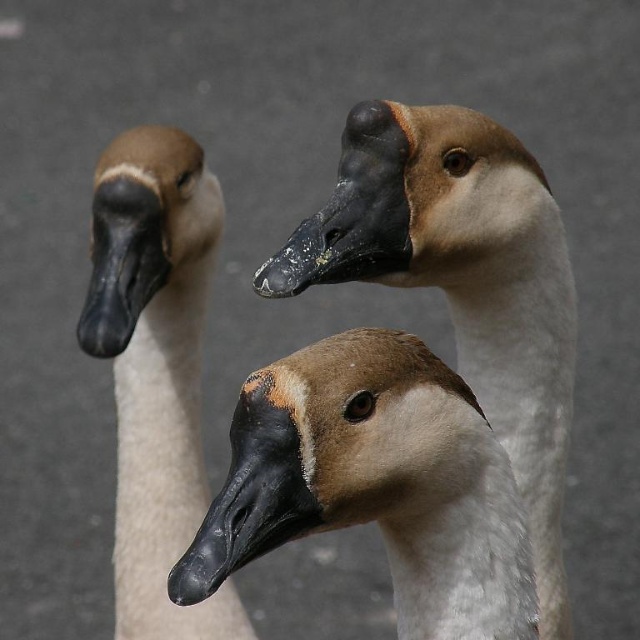
You are a photographer trying to capture a group photo of the brown matte swan at center and the matte black goose head at left. If you want to ensure both subjects are fully visible in the frame without cropping, which subject requires more space horizontally?

The brown matte swan at center requires more horizontal space because its width surpasses that of the matte black goose head at left.

You are a photographer aiming to capture a photo where the brown matte swan at center and the matte brown goose at left are both in focus. Given that your camera can only focus on objects within a 20 cm height difference, will the height difference between them cause any focusing issues?

The brown matte swan at center has a lesser height compared to the matte brown goose at left. Since the height difference is not specified, but the camera can handle up to 20 cm, it is likely within range unless the difference exceeds 20 cm. However, without exact measurements, we cannot confirm. But according to the description, the swan is shorter, so if the difference is under 20 cm, it should be okay.